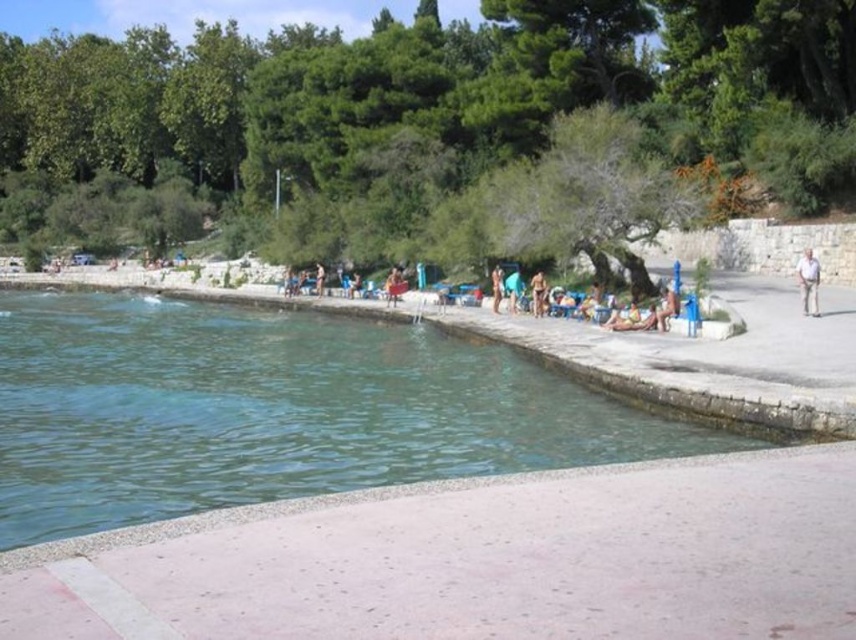
Is clear concrete pool at center bigger than white cotton shirt at right?

Yes, clear concrete pool at center is bigger than white cotton shirt at right.

Which of these two, clear concrete pool at center or white cotton shirt at right, stands taller?

clear concrete pool at center

You are a GUI agent. You are given a task and a screenshot of the screen. Output one action in this format:
    pyautogui.click(x=<x>, y=<y>)
    Task: Click on the clear concrete pool at center
    The image size is (856, 640).
    Given the screenshot: What is the action you would take?
    pyautogui.click(x=271, y=410)

Where is `clear concrete pool at center`? clear concrete pool at center is located at coordinates (271, 410).

I want to click on white cotton shirt at right, so click(x=807, y=282).

Does white cotton shirt at right have a lesser width compared to tan skin person at center?

No, white cotton shirt at right is not thinner than tan skin person at center.

Which is in front, point (809, 275) or point (660, 312)?

Point (809, 275) is more forward.

The width and height of the screenshot is (856, 640). In order to click on white cotton shirt at right in this screenshot , I will do `click(807, 282)`.

Which is more to the right, beige fabric chair at center or blue fabric towel at center?

blue fabric towel at center

Consider the image. Does beige fabric chair at center have a lesser height compared to blue fabric towel at center?

Incorrect, beige fabric chair at center's height does not fall short of blue fabric towel at center's.

Locate an element on the screen. Image resolution: width=856 pixels, height=640 pixels. beige fabric chair at center is located at coordinates point(393,285).